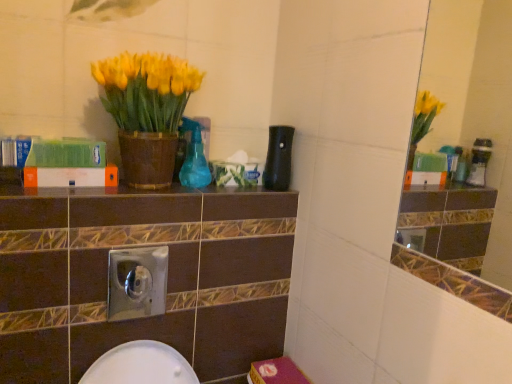
Locate an element on the screen. This screenshot has height=384, width=512. brown glossy ledge at center is located at coordinates (124, 191).

Find the location of `yellow matte vase at upper left`. yellow matte vase at upper left is located at coordinates (146, 111).

Is white matte book at center, arranged as the second book when viewed from the top, wider or thinner than brown glossy ledge at center?

Considering their sizes, white matte book at center, arranged as the second book when viewed from the top, looks slimmer than brown glossy ledge at center.

Considering the positions of point (106, 181) and point (248, 193), is point (106, 181) closer or farther from the camera than point (248, 193)?

Point (106, 181) is closer to the camera than point (248, 193).

From the image's perspective, which is above, white matte book at center, the 1th book positioned from the bottom, or brown glossy ledge at center?

white matte book at center, the 1th book positioned from the bottom, is shown above in the image.

In the scene shown: Between white matte book at center, arranged as the second book when viewed from the top, and brown glossy ledge at center, which one has more height?

white matte book at center, arranged as the second book when viewed from the top, is taller.

This screenshot has width=512, height=384. There is a yellow matte vase at upper left. What are the coordinates of `the 2nd book below it (from the image's perspective)` in the screenshot? It's located at (70, 177).

Between white matte book at center, arranged as the second book when viewed from the top, and yellow matte vase at upper left, which one is positioned in front?

yellow matte vase at upper left is more forward.

From the image's perspective, would you say white matte book at center, the 1th book positioned from the bottom, is shown under yellow matte vase at upper left?

Yes, from the image's perspective, white matte book at center, the 1th book positioned from the bottom, is below yellow matte vase at upper left.

From a real-world perspective, which object stands above the other?

yellow matte vase at upper left.

From a real-world perspective, is brown glossy ledge at center on yellow matte vase at upper left?

No, from a real-world perspective, brown glossy ledge at center is not above yellow matte vase at upper left.

Is brown glossy ledge at center in front of or behind yellow matte vase at upper left in the image?

Visually, brown glossy ledge at center is located behind yellow matte vase at upper left.

From their relative heights in the image, would you say brown glossy ledge at center is taller or shorter than yellow matte vase at upper left?

In the image, brown glossy ledge at center appears to be shorter than yellow matte vase at upper left.

Consider the image. Is brown glossy ledge at center completely or partially outside of yellow matte vase at upper left?

That's correct, brown glossy ledge at center is outside of yellow matte vase at upper left.

Which is more to the left, green matte book at upper left, arranged as the 2th book when ordered from the bottom, or yellow matte vase at upper left?

green matte book at upper left, arranged as the 2th book when ordered from the bottom.

From a real-world perspective, is green matte book at upper left, arranged as the 2th book when ordered from the bottom, beneath yellow matte vase at upper left?

Yes, from a real-world perspective, green matte book at upper left, arranged as the 2th book when ordered from the bottom, is below yellow matte vase at upper left.

In terms of height, does green matte book at upper left, acting as the 1th book starting from the top, look taller or shorter compared to yellow matte vase at upper left?

Considering their sizes, green matte book at upper left, acting as the 1th book starting from the top, has less height than yellow matte vase at upper left.

Which book is the 1st one when counting from the back of the yellow matte vase at upper left? Please provide its 2D coordinates.

[(67, 154)]

Can you confirm if green matte book at upper left, arranged as the 2th book when ordered from the bottom, is wider than white matte book at center, arranged as the second book when viewed from the top?

Yes.

Is green matte book at upper left, acting as the 1th book starting from the top, aimed at white matte book at center, the 1th book positioned from the bottom?

No.

Can you tell me how much green matte book at upper left, acting as the 1th book starting from the top, and white matte book at center, the 1th book positioned from the bottom, differ in facing direction?

There is a 0.0236-degree angle between the facing directions of green matte book at upper left, acting as the 1th book starting from the top, and white matte book at center, the 1th book positioned from the bottom.

Is green matte book at upper left, arranged as the 2th book when ordered from the bottom, completely or partially outside of white matte book at center, the 1th book positioned from the bottom?

Yes, green matte book at upper left, arranged as the 2th book when ordered from the bottom, is outside of white matte book at center, the 1th book positioned from the bottom.

From the image's perspective, which one is positioned lower, yellow matte vase at upper left or white matte book at center, arranged as the second book when viewed from the top?

white matte book at center, arranged as the second book when viewed from the top, appears lower in the image.

Considering the relative sizes of yellow matte vase at upper left and white matte book at center, the 1th book positioned from the bottom, in the image provided, is yellow matte vase at upper left thinner than white matte book at center, the 1th book positioned from the bottom,?

No, yellow matte vase at upper left is not thinner than white matte book at center, the 1th book positioned from the bottom.

Can we say yellow matte vase at upper left lies outside white matte book at center, the 1th book positioned from the bottom?

yellow matte vase at upper left lies outside white matte book at center, the 1th book positioned from the bottom,'s area.

Consider the image. Is green matte book at upper left, acting as the 1th book starting from the top, surrounded by yellow matte vase at upper left?

That's incorrect, green matte book at upper left, acting as the 1th book starting from the top, is not inside yellow matte vase at upper left.

Is yellow matte vase at upper left facing towards green matte book at upper left, acting as the 1th book starting from the top?

No.

Image resolution: width=512 pixels, height=384 pixels. In order to click on houseplant above the green matte book at upper left, acting as the 1th book starting from the top (from the image's perspective) in this screenshot , I will do `click(146, 111)`.

The height and width of the screenshot is (384, 512). Find the location of `book that is the 1st object above the brown glossy ledge at center (from a real-world perspective)`. book that is the 1st object above the brown glossy ledge at center (from a real-world perspective) is located at coordinates (70, 177).

You are a GUI agent. You are given a task and a screenshot of the screen. Output one action in this format:
    pyautogui.click(x=<x>, y=<y>)
    Task: Click on the houseplant on the right of white matte book at center, arranged as the second book when viewed from the top
    This screenshot has height=384, width=512.
    Given the screenshot: What is the action you would take?
    pyautogui.click(x=146, y=111)

Which object lies nearer to the anchor point yellow matte vase at upper left, brown glossy ledge at center or white matte book at center, arranged as the second book when viewed from the top?

white matte book at center, arranged as the second book when viewed from the top.

Looking at the image, which one is located closer to yellow matte vase at upper left, white matte book at center, the 1th book positioned from the bottom, or green matte book at upper left, arranged as the 2th book when ordered from the bottom?

green matte book at upper left, arranged as the 2th book when ordered from the bottom, lies closer to yellow matte vase at upper left than the other object.

Which object lies nearer to the anchor point yellow matte vase at upper left, brown glossy ledge at center or green matte book at upper left, arranged as the 2th book when ordered from the bottom?

green matte book at upper left, arranged as the 2th book when ordered from the bottom, is closer to yellow matte vase at upper left.

Considering their positions, is yellow matte vase at upper left positioned closer to white matte book at center, arranged as the second book when viewed from the top, than brown glossy ledge at center?

brown glossy ledge at center is positioned closer to the anchor white matte book at center, arranged as the second book when viewed from the top.

Based on their spatial positions, is white matte book at center, the 1th book positioned from the bottom, or yellow matte vase at upper left further from brown glossy ledge at center?

yellow matte vase at upper left lies further to brown glossy ledge at center than the other object.

Based on their spatial positions, is green matte book at upper left, acting as the 1th book starting from the top, or brown glossy ledge at center further from white matte book at center, the 1th book positioned from the bottom?

brown glossy ledge at center lies further to white matte book at center, the 1th book positioned from the bottom, than the other object.

Estimate the real-world distances between objects in this image. Which object is further from brown glossy ledge at center, green matte book at upper left, acting as the 1th book starting from the top, or yellow matte vase at upper left?

Among the two, yellow matte vase at upper left is located further to brown glossy ledge at center.

Looking at the image, which one is located closer to brown glossy ledge at center, green matte book at upper left, arranged as the 2th book when ordered from the bottom, or white matte book at center, arranged as the second book when viewed from the top?

Among the two, white matte book at center, arranged as the second book when viewed from the top, is located nearer to brown glossy ledge at center.

Where is `book between green matte book at upper left, arranged as the 2th book when ordered from the bottom, and brown glossy ledge at center`? The width and height of the screenshot is (512, 384). book between green matte book at upper left, arranged as the 2th book when ordered from the bottom, and brown glossy ledge at center is located at coordinates (70, 177).

The height and width of the screenshot is (384, 512). In order to click on houseplant between white matte book at center, arranged as the second book when viewed from the top, and brown glossy ledge at center from left to right in this screenshot , I will do `click(146, 111)`.

In order to click on houseplant between green matte book at upper left, acting as the 1th book starting from the top, and brown glossy ledge at center, in the horizontal direction in this screenshot , I will do `click(146, 111)`.

This screenshot has width=512, height=384. I want to click on book between green matte book at upper left, arranged as the 2th book when ordered from the bottom, and yellow matte vase at upper left, in the horizontal direction, so click(70, 177).